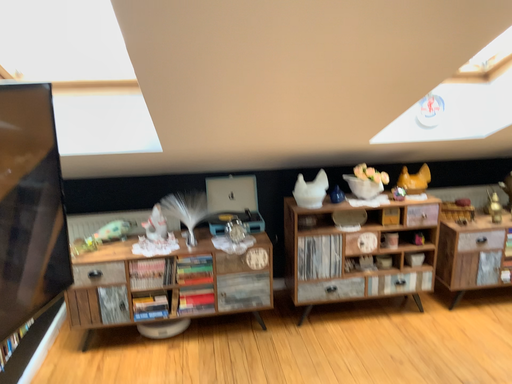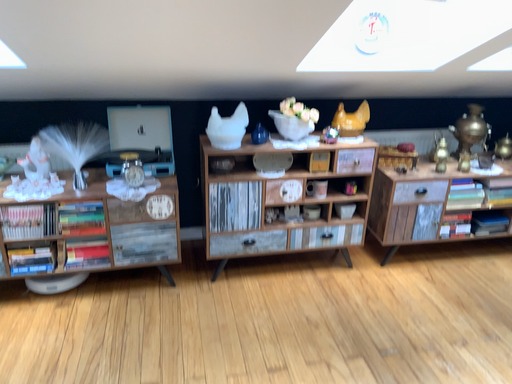
Question: How did the camera likely rotate when shooting the video?

Choices:
 (A) rotated upward
 (B) rotated downward

Answer: (B)